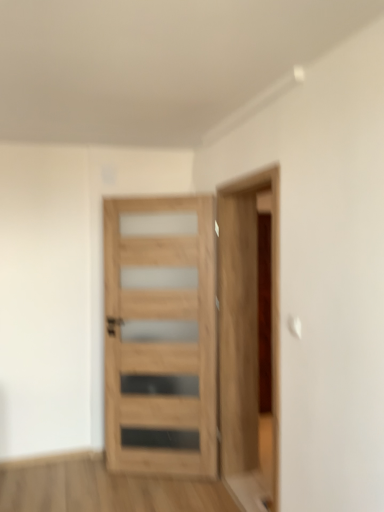
Where is `vacant space positioned to the left of natural wood door at center`? This screenshot has height=512, width=384. vacant space positioned to the left of natural wood door at center is located at coordinates (89, 485).